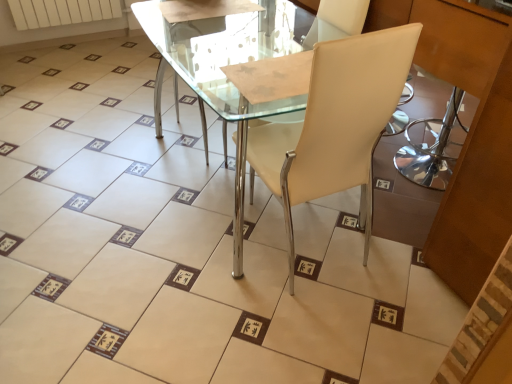
This screenshot has width=512, height=384. I want to click on vacant space that is to the left of transparent glass table at center, so click(x=143, y=129).